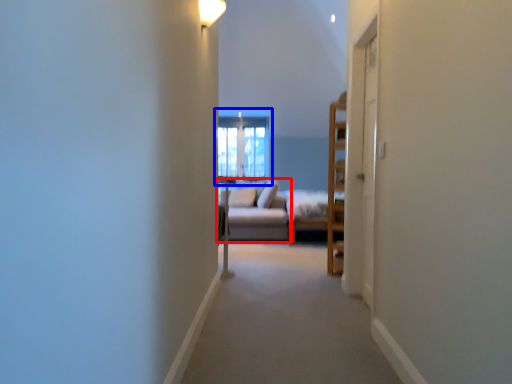
Question: Which point is further to the camera, studio couch (highlighted by a red box) or window (highlighted by a blue box)?

Choices:
 (A) studio couch
 (B) window

Answer: (B)